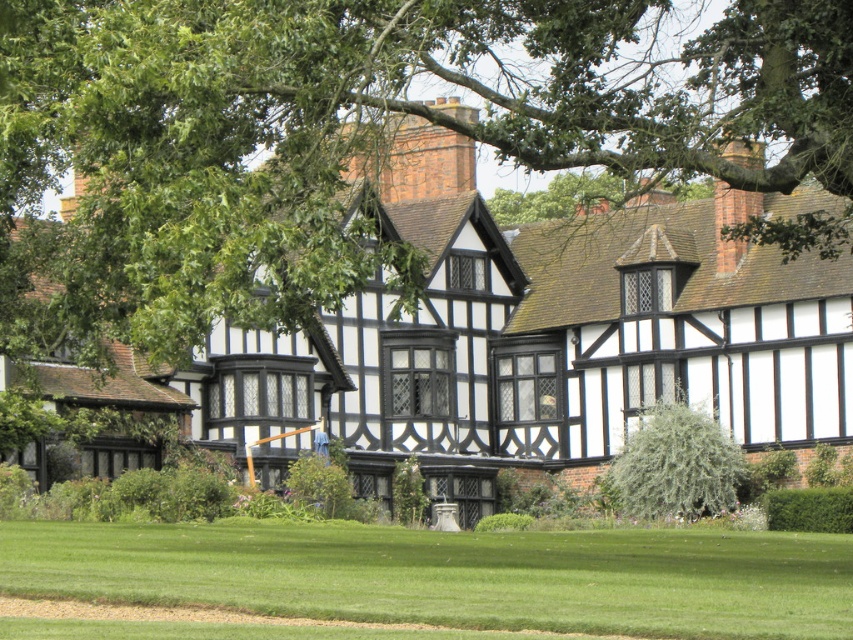
You are a gardener planning to plant a new flower bed. You have two areas to choose from the green grass at lower center and the green fuzzy bush at center. Which area has more space available for planting?

The green grass at lower center has a larger width than the green fuzzy bush at center, so it has more space available for planting.

You are standing on the green grass at lower center and looking towards the green leafy tree at upper center. Which object is larger in size?

The green leafy tree at upper center is bigger than the green grass at lower center.

You are standing on the lawn and want to plant a new flower bed between the green leafy tree at upper center and the green fuzzy bush at center. Which direction should you move to ensure the flower bed is between them?

To place the flower bed between the green leafy tree at upper center and the green fuzzy bush at center, you should move downward from the green leafy tree at upper center towards the green fuzzy bush at center since the tree is positioned over the bush.